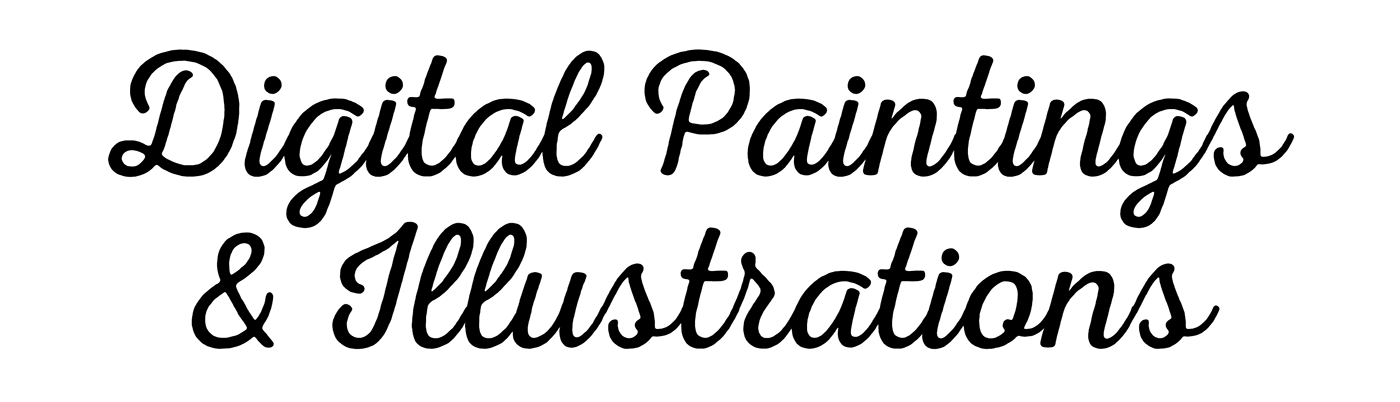
Find the location of a particular element. The height and width of the screenshot is (402, 1400). paintings is located at coordinates (952, 144).